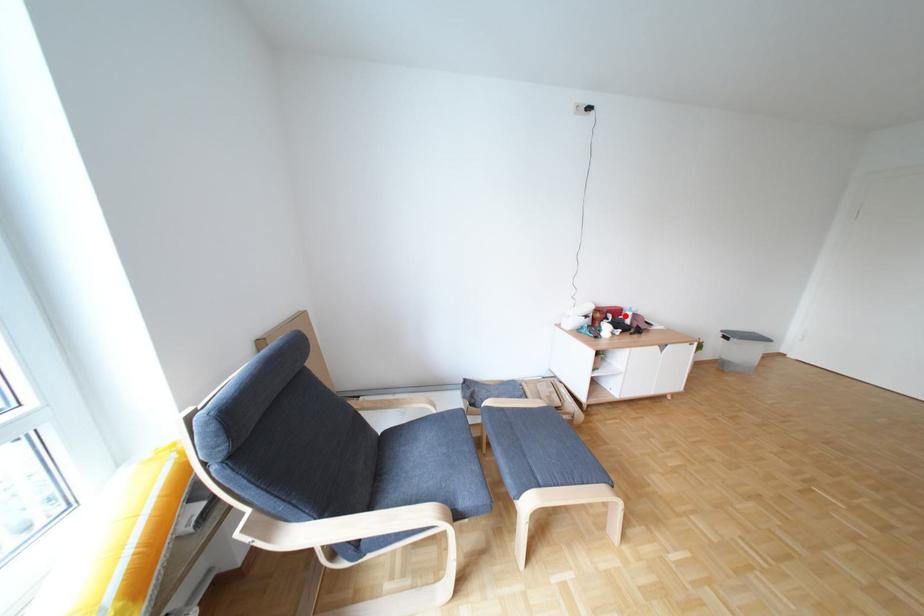
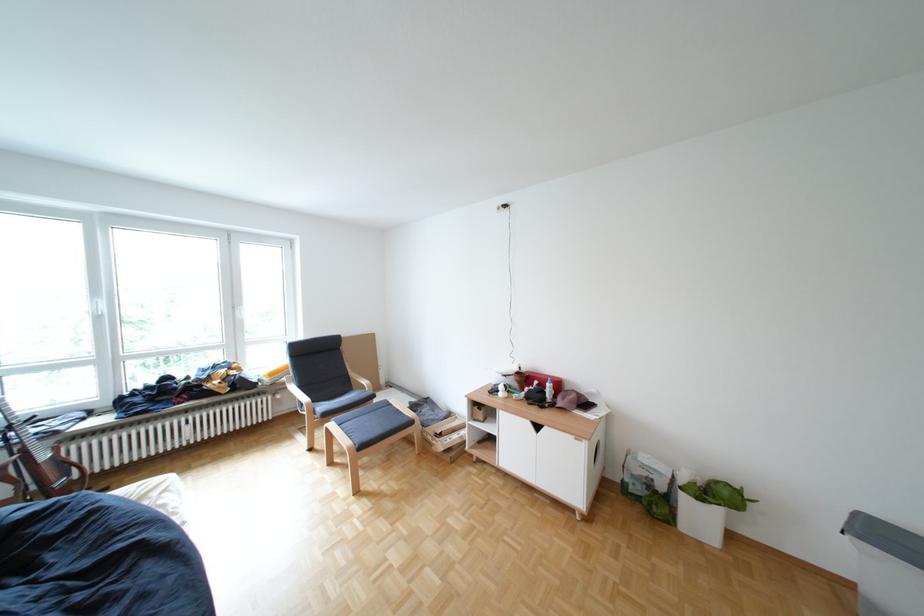
In the second image, find the point that corresponds to the highlighted location in the first image.

(552, 383)